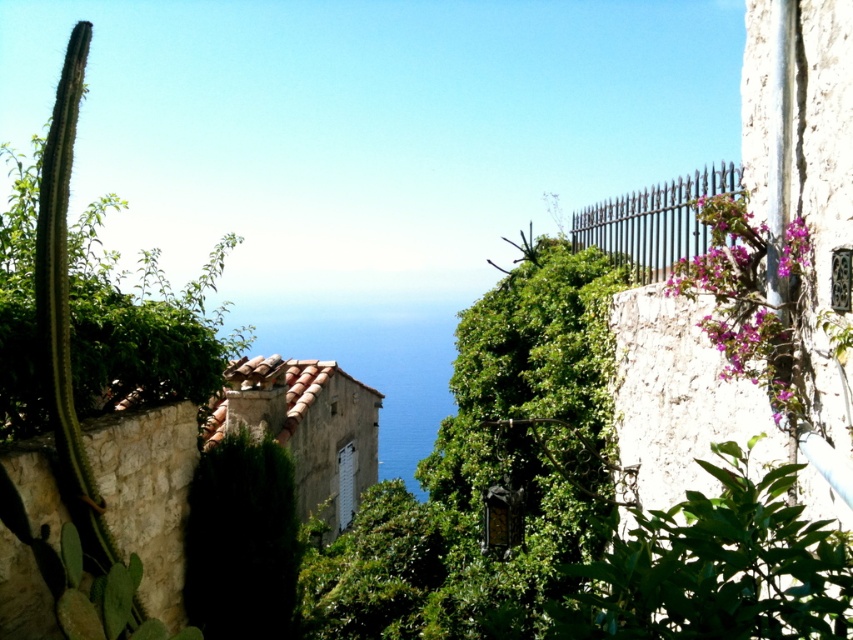
Between pink matte flowers at upper right and purple matte flowers at upper right, which one is positioned lower?

pink matte flowers at upper right

How distant is pink matte flowers at upper right from purple matte flowers at upper right?

A distance of 31.13 centimeters exists between pink matte flowers at upper right and purple matte flowers at upper right.

Who is more forward, (753, 300) or (786, 236)?

Point (786, 236)

Where is `pink matte flowers at upper right`? This screenshot has height=640, width=853. pink matte flowers at upper right is located at coordinates (751, 300).

Which is behind, point (618, 216) or point (805, 244)?

Positioned behind is point (618, 216).

Which of these two, black wrought iron fence at upper right or purple matte flowers at upper right, stands shorter?

purple matte flowers at upper right is shorter.

Who is more forward, (604, 208) or (809, 259)?

Point (809, 259) is in front.

What are the coordinates of `black wrought iron fence at upper right` in the screenshot? It's located at (654, 221).

Can you confirm if pink matte flowers at upper right is positioned to the right of black wrought iron fence at upper right?

In fact, pink matte flowers at upper right is to the left of black wrought iron fence at upper right.

Measure the distance between pink matte flowers at upper right and black wrought iron fence at upper right.

A distance of 35.04 inches exists between pink matte flowers at upper right and black wrought iron fence at upper right.

The height and width of the screenshot is (640, 853). What are the coordinates of `pink matte flowers at upper right` in the screenshot? It's located at (751, 300).

At what (x,y) coordinates should I click in order to perform the action: click on pink matte flowers at upper right. Please return your answer as a coordinate pair (x, y). Looking at the image, I should click on (751, 300).